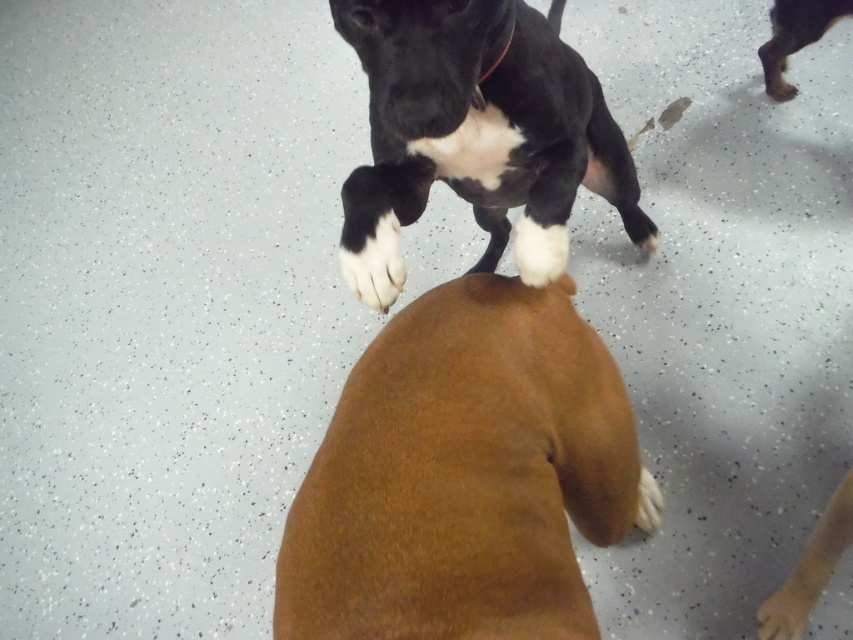
You are a dog trainer who needs to ensure the dogs are spaced appropriately for safety. The safety guideline requires at least 30 inches between dogs during training sessions. Based on the scene, are the black smooth dog at upper center and the brown fur dog at upper right meeting this requirement?

The distance between the black smooth dog at upper center and the brown fur dog at upper right is 31.11 inches, which exceeds the minimum requirement of 30 inches. Therefore, they are meeting the safety guideline.

You are a dog trainer observing the scene. You need to determine the relative positions of the white matte paw at center and the black nylon neckband at upper center. Based on the spatial relationship between them, which object is higher in the image?

The white matte paw at center is taller than the black nylon neckband at upper center, so the white matte paw at center is higher in the image.